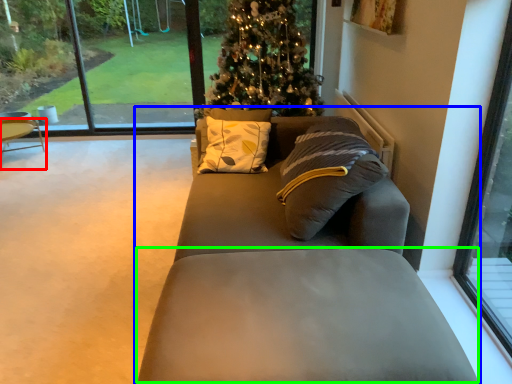
Question: Which is farther away from chair (highlighted by a red box)? studio couch (highlighted by a blue box) or footrest (highlighted by a green box)?

Choices:
 (A) studio couch
 (B) footrest

Answer: (B)